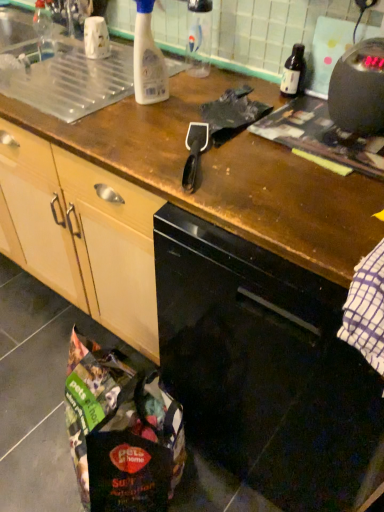
Where is `free location in front of translucent plastic spray bottle at upper center, arranged as the third bottle when viewed from the right`? The width and height of the screenshot is (384, 512). free location in front of translucent plastic spray bottle at upper center, arranged as the third bottle when viewed from the right is located at coordinates (137, 126).